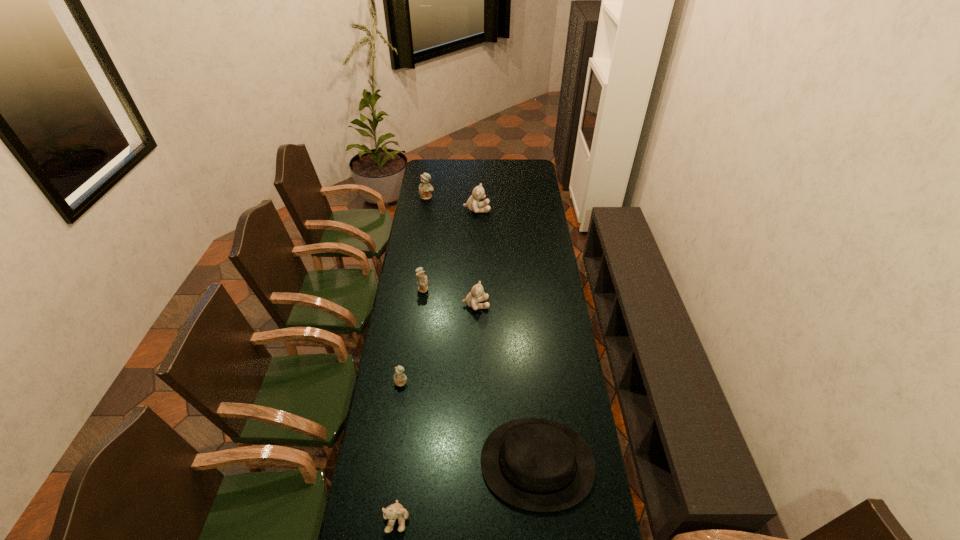
At what (x,y) coordinates should I click in order to perform the action: click on the third nearest object. Please return your answer as a coordinate pair (x, y). This screenshot has height=540, width=960. Looking at the image, I should click on (400, 378).

Image resolution: width=960 pixels, height=540 pixels. In order to click on the nearest teddy bear in this screenshot , I will do `click(395, 511)`.

At what (x,y) coordinates should I click in order to perform the action: click on the smallest gray teddy bear. Please return your answer as a coordinate pair (x, y). The image size is (960, 540). Looking at the image, I should click on (395, 511).

This screenshot has width=960, height=540. In order to click on vacant point located 0.220m on the front-facing side of the farthest teddy bear in this screenshot , I will do `click(423, 224)`.

Where is `vacant space located on the face of the fifth nearest teddy bear`? This screenshot has height=540, width=960. vacant space located on the face of the fifth nearest teddy bear is located at coordinates (535, 210).

Locate an element on the screen. vacant position located 0.080m on the front-facing side of the second biggest blue teddy bear is located at coordinates (446, 288).

At what (x,y) coordinates should I click in order to perform the action: click on vacant space located 0.260m on the face of the second smallest gray teddy bear. Please return your answer as a coordinate pair (x, y). The height and width of the screenshot is (540, 960). Looking at the image, I should click on (548, 305).

Where is `vacant space located on the left of the black fedora`? vacant space located on the left of the black fedora is located at coordinates (462, 463).

Where is `free space located 0.350m on the front-facing side of the smallest blue teddy bear`? This screenshot has height=540, width=960. free space located 0.350m on the front-facing side of the smallest blue teddy bear is located at coordinates (387, 484).

Find the location of `object located at the right edge`. object located at the right edge is located at coordinates (535, 464).